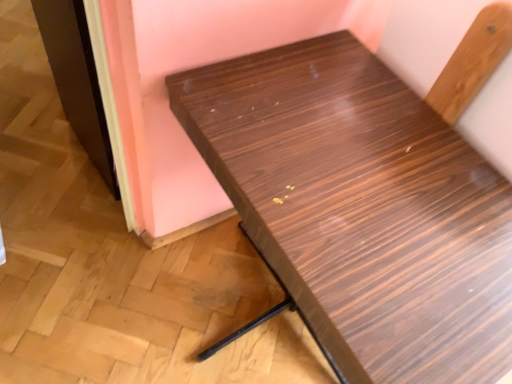
Where is `free spot below wooden table at center (from a real-world perspective)`? free spot below wooden table at center (from a real-world perspective) is located at coordinates (251, 309).